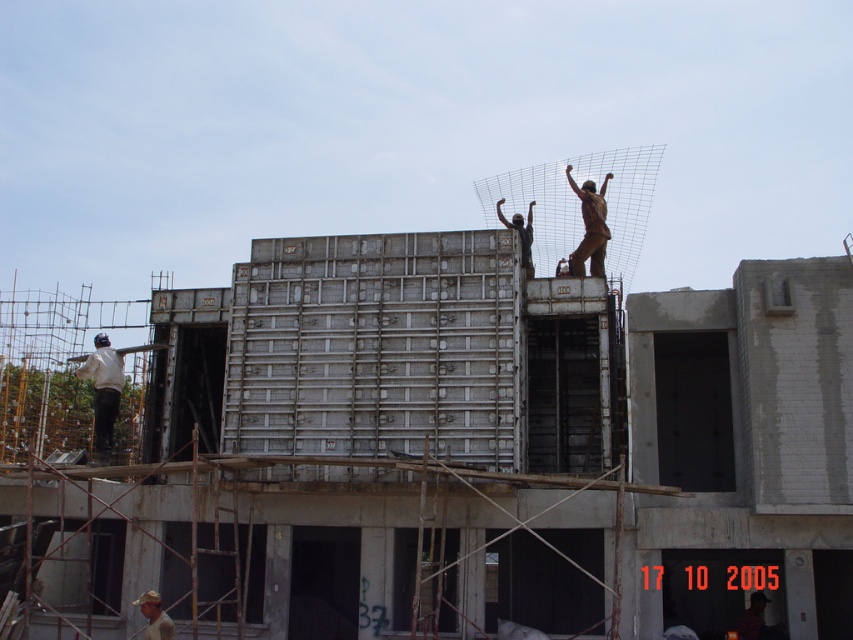
Can you confirm if bronze statue at upper right is taller than matte black statue at upper center?

Yes, bronze statue at upper right is taller than matte black statue at upper center.

Can you confirm if bronze statue at upper right is positioned to the right of matte black statue at upper center?

Indeed, bronze statue at upper right is positioned on the right side of matte black statue at upper center.

Between point (596, 268) and point (526, 228), which one is positioned behind?

Positioned behind is point (526, 228).

At what (x,y) coordinates should I click in order to perform the action: click on bronze statue at upper right. Please return your answer as a coordinate pair (x, y). The width and height of the screenshot is (853, 640). Looking at the image, I should click on (590, 227).

Based on the photo, is tan fabric cap at lower left to the right of matte black statue at upper center from the viewer's perspective?

Incorrect, tan fabric cap at lower left is not on the right side of matte black statue at upper center.

Does point (163, 614) come farther from viewer compared to point (511, 224)?

No.

This screenshot has height=640, width=853. Find the location of `tan fabric cap at lower left`. tan fabric cap at lower left is located at coordinates (154, 616).

Which is more to the right, bronze statue at upper right or tan fabric cap at lower left?

bronze statue at upper right is more to the right.

Does point (602, 232) come closer to viewer compared to point (155, 621)?

No, (602, 232) is behind (155, 621).

This screenshot has width=853, height=640. Find the location of `bronze statue at upper right`. bronze statue at upper right is located at coordinates click(590, 227).